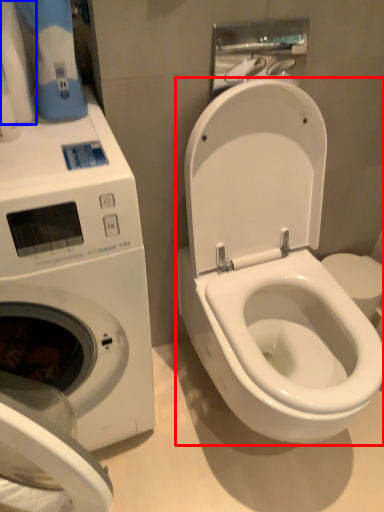
Question: Among these objects, which one is farthest to the camera, toilet (highlighted by a red box) or toilet paper (highlighted by a blue box)?

Choices:
 (A) toilet
 (B) toilet paper

Answer: (B)